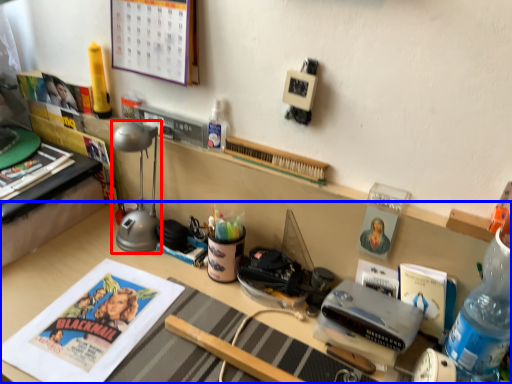
Question: Which object appears closest to the camera in this image, table lamp (highlighted by a red box) or desk (highlighted by a blue box)?

Choices:
 (A) table lamp
 (B) desk

Answer: (B)